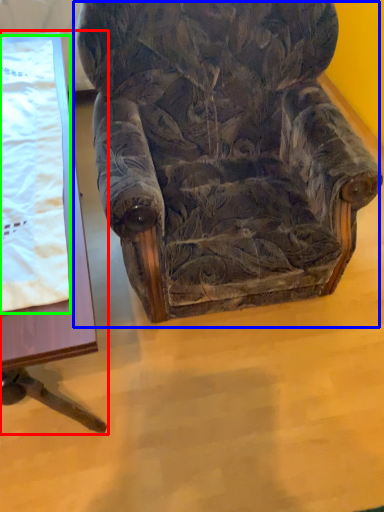
Question: Which is farther away from table (highlighted by a red box)? chair (highlighted by a blue box) or blanket (highlighted by a green box)?

Choices:
 (A) chair
 (B) blanket

Answer: (A)